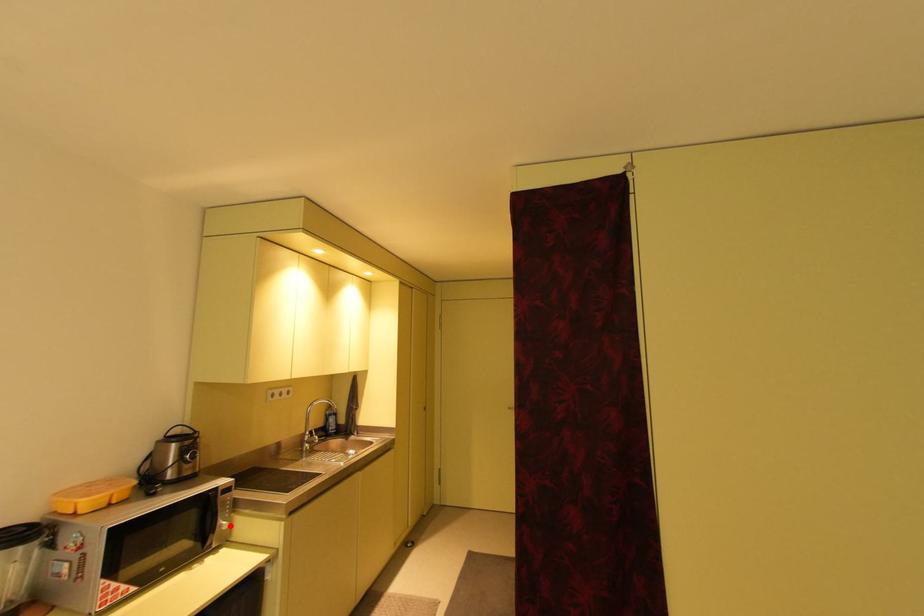
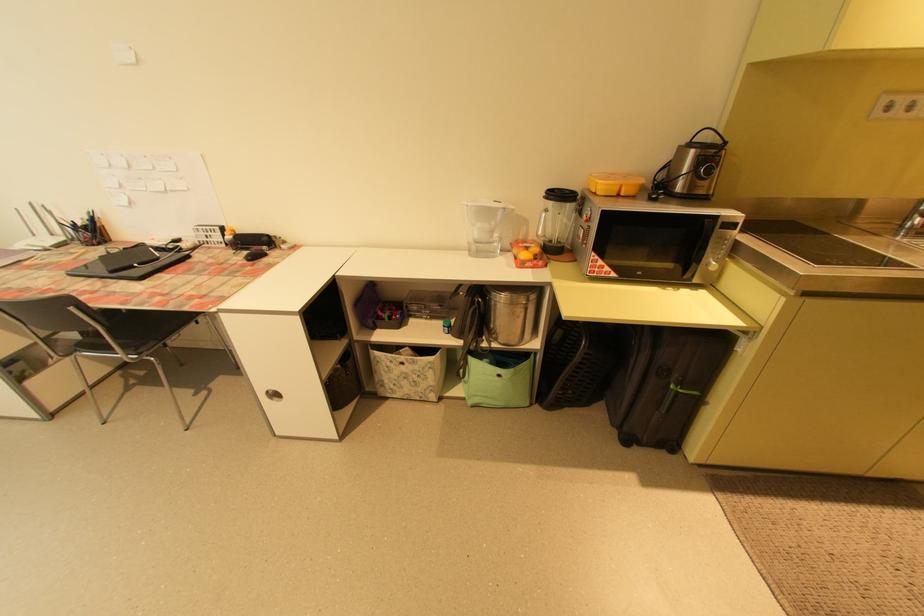
Where in the second image is the point corresponding to the highlighted location from the first image?

(720, 265)